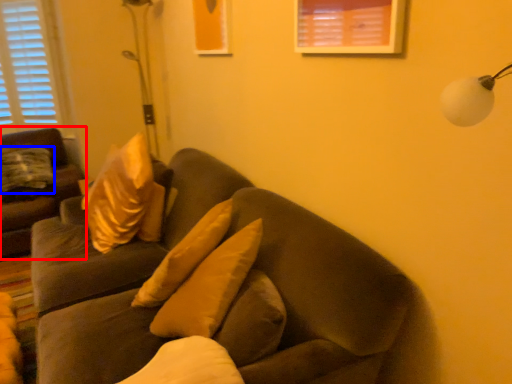
Question: Among these objects, which one is farthest to the camera, studio couch (highlighted by a red box) or pillow (highlighted by a blue box)?

Choices:
 (A) studio couch
 (B) pillow

Answer: (B)